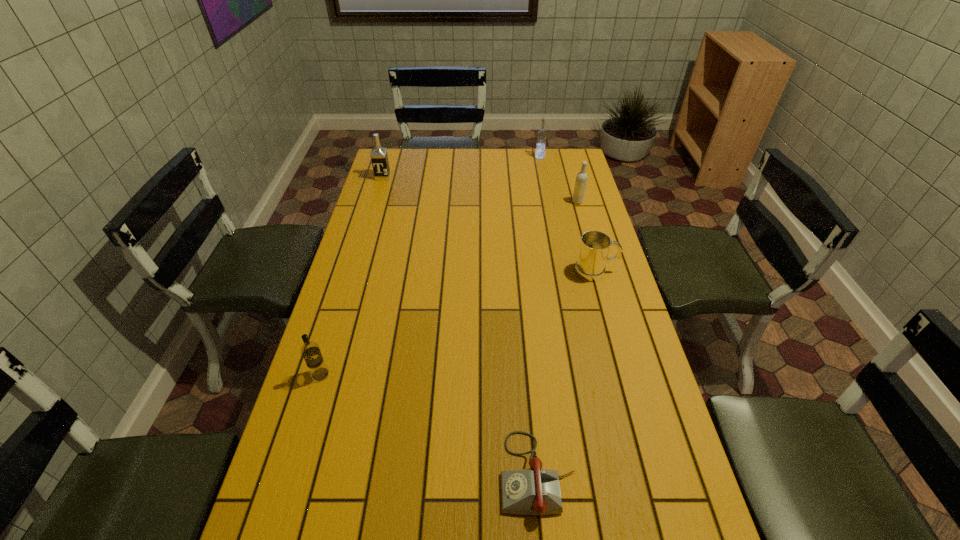
Locate an element on the screen. The image size is (960, 540). free space at the far edge is located at coordinates (488, 167).

The width and height of the screenshot is (960, 540). Find the location of `free space at the left edge of the desktop`. free space at the left edge of the desktop is located at coordinates (390, 184).

The width and height of the screenshot is (960, 540). Find the location of `vacant space at the right edge of the desktop`. vacant space at the right edge of the desktop is located at coordinates (565, 265).

Image resolution: width=960 pixels, height=540 pixels. I want to click on free spot between the shortest object and the fourth nearest object, so click(x=558, y=338).

Find the location of `free space between the nearest object and the second shortest object`. free space between the nearest object and the second shortest object is located at coordinates (566, 373).

Where is `vacant point located between the third object from right to left and the telephone`? vacant point located between the third object from right to left and the telephone is located at coordinates (539, 315).

Where is `vacant space that's between the shortest object and the second farthest object`? The image size is (960, 540). vacant space that's between the shortest object and the second farthest object is located at coordinates (460, 325).

Locate an element on the screen. free space between the farthest vodka and the fifth farthest object is located at coordinates (430, 266).

You are a GUI agent. You are given a task and a screenshot of the screen. Output one action in this format:
    pyautogui.click(x=<x>, y=<y>)
    Task: Click on the vacant space in between the second farthest object and the fifth tallest object
    Image resolution: width=960 pixels, height=540 pixels.
    Given the screenshot: What is the action you would take?
    pyautogui.click(x=490, y=224)

The image size is (960, 540). What are the coordinates of `empty space that is in between the fourth nearest object and the farthest object` in the screenshot? It's located at (559, 180).